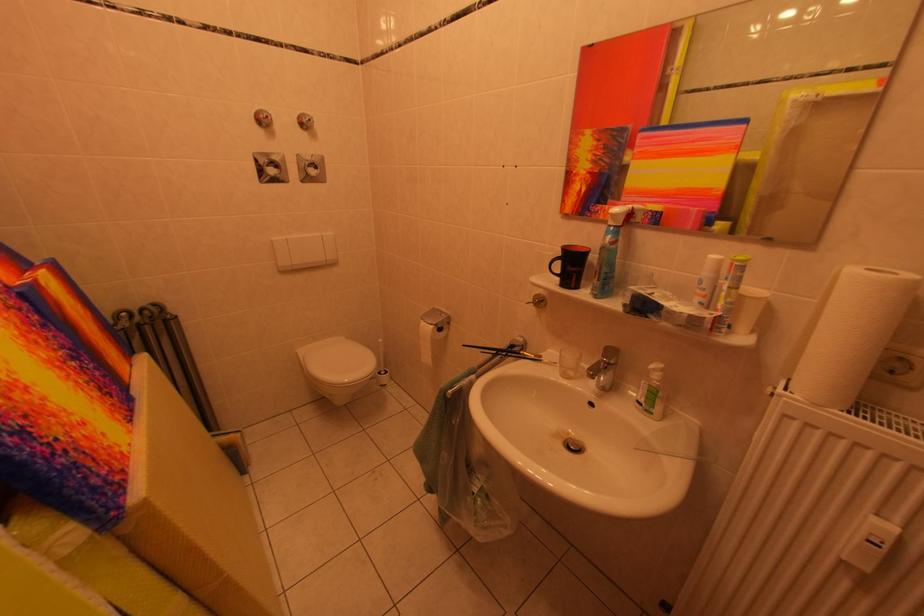
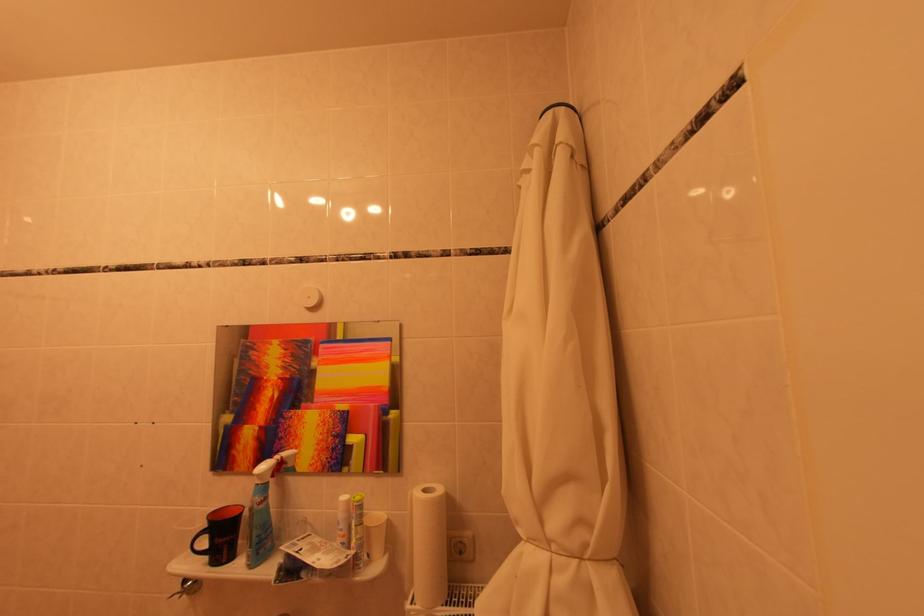
Find the pixel in the second image that matches pixel 744 261 in the first image.

(362, 501)